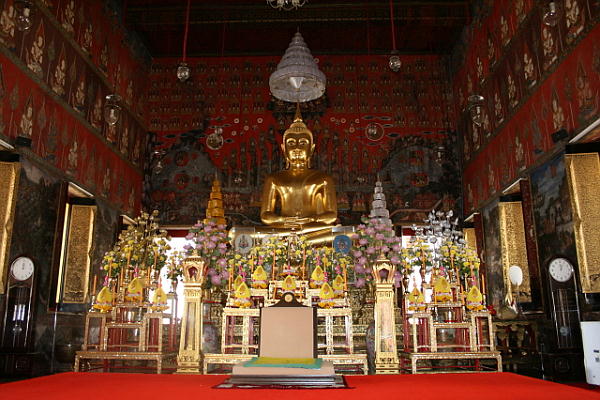
At what (x,y) coordinates should I click in order to perform the action: click on light. Please return your answer as a coordinate pair (x, y). The image size is (600, 400). Looking at the image, I should click on click(302, 73).